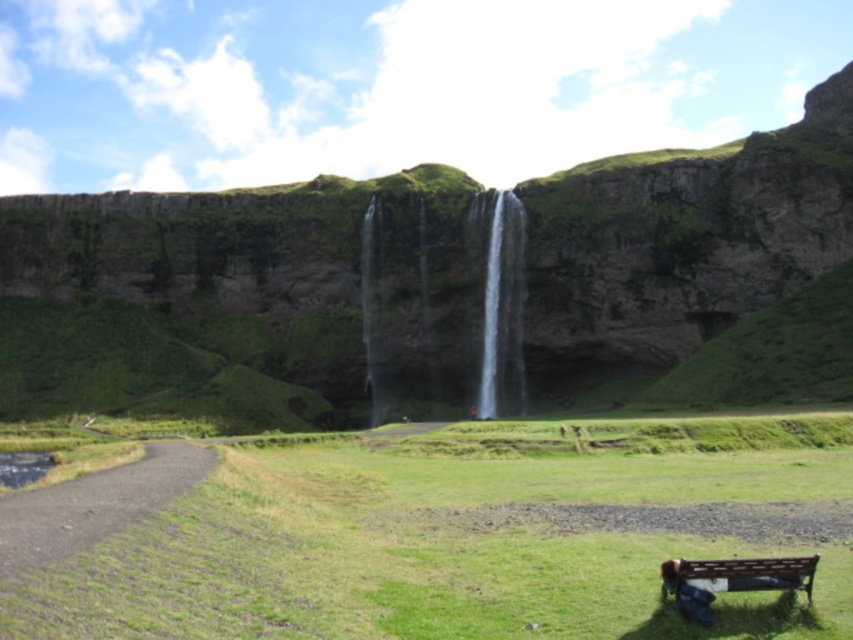
You are planning to set up a small picnic area in the scene. Given that the green grassy hillside at center and the clear water at center are both potential spots, which location would be more suitable based on their sizes?

The green grassy hillside at center is larger in size than the clear water at center, making it a more suitable spot for a picnic.

You are planning to install a new walking trail between the green grassy hillside at center and the green grassy field at center. Given that the trail requires a minimum of 100 feet of space, will there be sufficient room to construct it?

The distance between the green grassy hillside at center and the green grassy field at center is 140.50 feet, which exceeds the required 100 feet. Therefore, there is sufficient space to construct the walking trail.